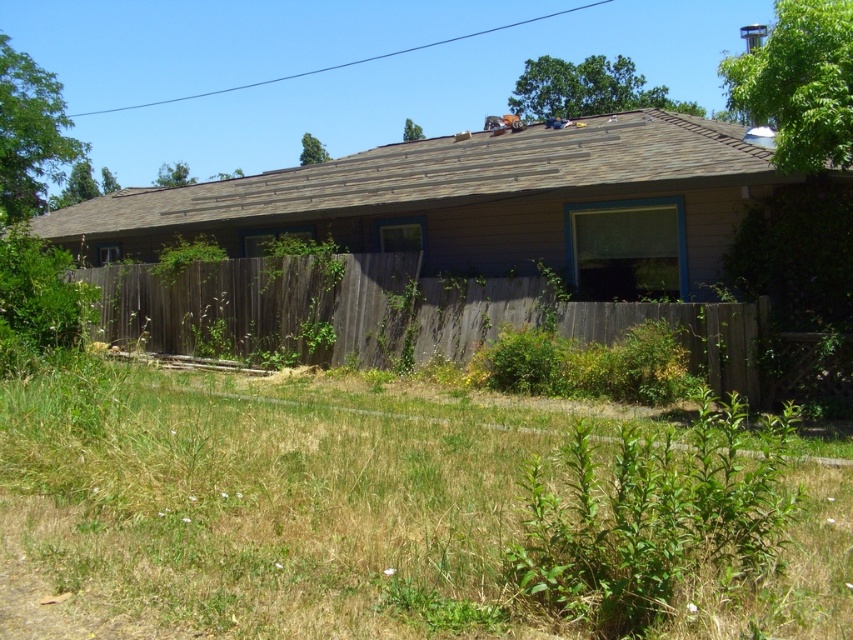
Is green grass at lower center in front of brown wood house at center?

Yes, green grass at lower center is in front of brown wood house at center.

Who is more distant from viewer, (88, 420) or (604, 292)?

Positioned behind is point (604, 292).

What do you see at coordinates (270, 500) in the screenshot? This screenshot has height=640, width=853. I see `green grass at lower center` at bounding box center [270, 500].

The image size is (853, 640). In order to click on green grass at lower center in this screenshot , I will do [x=270, y=500].

Measure the distance between brown wood house at center and camera.

A distance of 30.21 feet exists between brown wood house at center and camera.

Who is higher up, brown wood house at center or weathered wood fence at center?

brown wood house at center is higher up.

Between point (62, 243) and point (196, 307), which one is positioned in front?

Positioned in front is point (196, 307).

The image size is (853, 640). In order to click on brown wood house at center in this screenshot , I will do `click(477, 204)`.

Locate an element on the screen. The image size is (853, 640). green grass at lower center is located at coordinates (270, 500).

Does green grass at lower center have a lesser width compared to weathered wood fence at center?

Yes.

The image size is (853, 640). What do you see at coordinates (270, 500) in the screenshot? I see `green grass at lower center` at bounding box center [270, 500].

Find the location of a particular element. The image size is (853, 640). green grass at lower center is located at coordinates (270, 500).